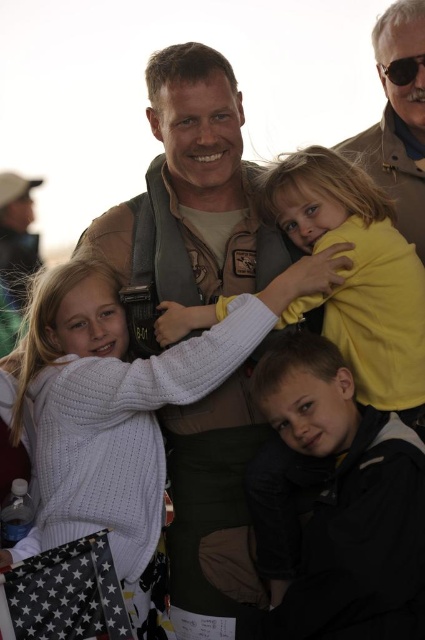
Is white knitted sweater at lower left wider than brown leather jacket at upper right?

Yes.

How distant is white knitted sweater at lower left from brown leather jacket at upper right?

A distance of 34.89 feet exists between white knitted sweater at lower left and brown leather jacket at upper right.

Is point (112, 428) positioned after point (376, 141)?

No, it is in front of (376, 141).

I want to click on white knitted sweater at lower left, so click(x=125, y=401).

This screenshot has width=425, height=640. What do you see at coordinates (348, 500) in the screenshot? I see `dark gray fleece jacket at lower right` at bounding box center [348, 500].

Locate an element on the screen. This screenshot has width=425, height=640. dark gray fleece jacket at lower right is located at coordinates (348, 500).

Does point (402, 620) lie behind point (424, 51)?

No, it is in front of (424, 51).

You are a GUI agent. You are given a task and a screenshot of the screen. Output one action in this format:
    pyautogui.click(x=<x>, y=<y>)
    Task: Click on the dark gray fleece jacket at lower right
    The height and width of the screenshot is (640, 425).
    Given the screenshot: What is the action you would take?
    pyautogui.click(x=348, y=500)

Between brown leather jacket at upper right and black plastic goggles at upper right, which one appears on the left side from the viewer's perspective?

brown leather jacket at upper right is more to the left.

Can you confirm if brown leather jacket at upper right is positioned above black plastic goggles at upper right?

No.

Which is in front, point (379, 22) or point (376, 60)?

Point (379, 22) is more forward.

You are a GUI agent. You are given a task and a screenshot of the screen. Output one action in this format:
    pyautogui.click(x=<x>, y=<y>)
    Task: Click on the brown leather jacket at upper right
    This screenshot has width=425, height=640.
    Given the screenshot: What is the action you would take?
    pyautogui.click(x=397, y=116)